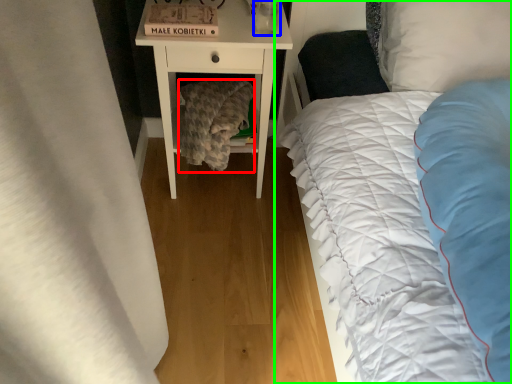
Question: Based on their relative distances, which object is nearer to blanket (highlighted by a red box)? Choose from glass vase (highlighted by a blue box) and bed (highlighted by a green box).

Choices:
 (A) glass vase
 (B) bed

Answer: (A)